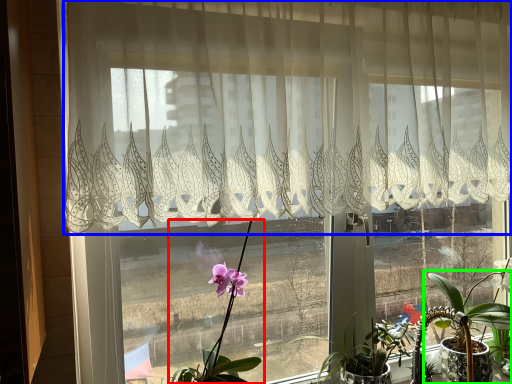
Question: Which is nearer to the houseplant (highlighted by a red box)? curtain (highlighted by a blue box) or houseplant (highlighted by a green box).

Choices:
 (A) curtain
 (B) houseplant

Answer: (A)